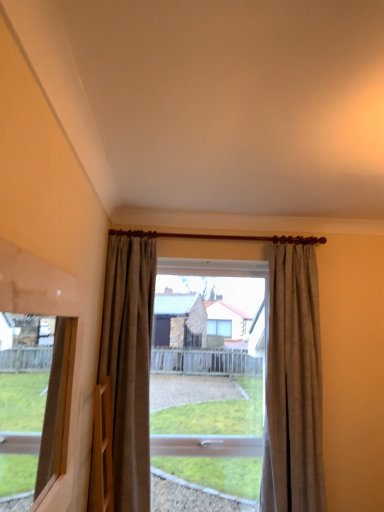
This screenshot has height=512, width=384. I want to click on matte brown curtain at center, positioned as the second curtain in right-to-left order, so click(x=129, y=362).

From the image's perspective, is beige textured curtain at center, acting as the 1th curtain starting from the right, located above or below wooden frame at left?

beige textured curtain at center, acting as the 1th curtain starting from the right, is below wooden frame at left.

Who is bigger, beige textured curtain at center, which appears as the second curtain when viewed from the left, or wooden frame at left?

Bigger between the two is beige textured curtain at center, which appears as the second curtain when viewed from the left.

Can you confirm if beige textured curtain at center, which appears as the second curtain when viewed from the left, is shorter than wooden frame at left?

Incorrect, the height of beige textured curtain at center, which appears as the second curtain when viewed from the left, does not fall short of that of wooden frame at left.

Does beige textured curtain at center, acting as the 1th curtain starting from the right, have a greater width compared to wooden frame at left?

Yes, beige textured curtain at center, acting as the 1th curtain starting from the right, is wider than wooden frame at left.

From a real-world perspective, between transparent glass window at center and beige textured curtain at center, acting as the 1th curtain starting from the right, who is vertically lower?

transparent glass window at center is physically lower.

Between point (160, 372) and point (308, 313), which one is positioned in front?

The point (308, 313) is more forward.

Is transparent glass window at center touching beige textured curtain at center, which appears as the second curtain when viewed from the left?

transparent glass window at center and beige textured curtain at center, which appears as the second curtain when viewed from the left, are clearly separated.

From the picture: Is matte brown curtain at center, arranged as the 1th curtain when viewed from the left, to the left or to the right of wooden frame at left in the image?

In the image, matte brown curtain at center, arranged as the 1th curtain when viewed from the left, appears on the right side of wooden frame at left.

From the image's perspective, between matte brown curtain at center, arranged as the 1th curtain when viewed from the left, and wooden frame at left, who is located below?

matte brown curtain at center, arranged as the 1th curtain when viewed from the left.

The image size is (384, 512). I want to click on window above the matte brown curtain at center, positioned as the second curtain in right-to-left order (from a real-world perspective), so click(32, 407).

Is transparent glass window at center not inside wooden frame at left?

transparent glass window at center is positioned outside wooden frame at left.

Locate an element on the screen. window above the transparent glass window at center (from the image's perspective) is located at coordinates (32, 407).

Who is bigger, transparent glass window at center or wooden frame at left?

transparent glass window at center is bigger.

Is point (165, 310) closer to camera compared to point (5, 480)?

That is False.

Can you tell me how much beige textured curtain at center, acting as the 1th curtain starting from the right, and transparent glass window at center differ in facing direction?

There is a 2.83-degree angle between the facing directions of beige textured curtain at center, acting as the 1th curtain starting from the right, and transparent glass window at center.

Considering the positions of objects beige textured curtain at center, which appears as the second curtain when viewed from the left, and transparent glass window at center in the image provided, who is more to the right, beige textured curtain at center, which appears as the second curtain when viewed from the left, or transparent glass window at center?

From the viewer's perspective, beige textured curtain at center, which appears as the second curtain when viewed from the left, appears more on the right side.

Is beige textured curtain at center, acting as the 1th curtain starting from the right, positioned behind transparent glass window at center?

No, beige textured curtain at center, acting as the 1th curtain starting from the right, is closer to the viewer.

From the image's perspective, between beige textured curtain at center, which appears as the second curtain when viewed from the left, and transparent glass window at center, who is located below?

From the image's view, transparent glass window at center is below.

From the image's perspective, is wooden frame at left positioned above or below transparent glass window at center?

Based on their image positions, wooden frame at left is located above transparent glass window at center.

Image resolution: width=384 pixels, height=512 pixels. I want to click on window in front of the transparent glass window at center, so click(32, 407).

Considering the positions of points (5, 350) and (177, 450), is point (5, 350) closer to camera compared to point (177, 450)?

Yes, it is in front of point (177, 450).

Is wooden frame at left wider or thinner than transparent glass window at center?

Clearly, wooden frame at left has less width compared to transparent glass window at center.

Is wooden frame at left at the left side of beige textured curtain at center, acting as the 1th curtain starting from the right?

Indeed, wooden frame at left is positioned on the left side of beige textured curtain at center, acting as the 1th curtain starting from the right.

Is wooden frame at left bigger or smaller than beige textured curtain at center, acting as the 1th curtain starting from the right?

Considering their sizes, wooden frame at left takes up less space than beige textured curtain at center, acting as the 1th curtain starting from the right.

Which is correct: wooden frame at left is inside beige textured curtain at center, acting as the 1th curtain starting from the right, or outside of it?

wooden frame at left is not enclosed by beige textured curtain at center, acting as the 1th curtain starting from the right.

Looking at this image, is wooden frame at left touching beige textured curtain at center, acting as the 1th curtain starting from the right?

No, wooden frame at left is not beside beige textured curtain at center, acting as the 1th curtain starting from the right.

Locate an element on the screen. This screenshot has height=512, width=384. the 1st curtain behind the wooden frame at left, starting your count from the anchor is located at coordinates (293, 386).

Where is `curtain that is on the right side of transparent glass window at center`? This screenshot has width=384, height=512. curtain that is on the right side of transparent glass window at center is located at coordinates (293, 386).

Considering their positions, is wooden frame at left positioned closer to transparent glass window at center than matte brown curtain at center, positioned as the second curtain in right-to-left order?

matte brown curtain at center, positioned as the second curtain in right-to-left order.

Considering their positions, is transparent glass window at center positioned further to wooden frame at left than matte brown curtain at center, arranged as the 1th curtain when viewed from the left?

transparent glass window at center is positioned further to the anchor wooden frame at left.

From the image, which object appears to be nearer to matte brown curtain at center, positioned as the second curtain in right-to-left order, beige textured curtain at center, which appears as the second curtain when viewed from the left, or transparent glass window at center?

The object closer to matte brown curtain at center, positioned as the second curtain in right-to-left order, is beige textured curtain at center, which appears as the second curtain when viewed from the left.

Estimate the real-world distances between objects in this image. Which object is further from matte brown curtain at center, arranged as the 1th curtain when viewed from the left, transparent glass window at center or beige textured curtain at center, which appears as the second curtain when viewed from the left?

transparent glass window at center.

Which object lies further to the anchor point transparent glass window at center, beige textured curtain at center, acting as the 1th curtain starting from the right, or wooden frame at left?

wooden frame at left is positioned further to the anchor transparent glass window at center.

Looking at this image, considering their positions, is matte brown curtain at center, positioned as the second curtain in right-to-left order, positioned further to beige textured curtain at center, acting as the 1th curtain starting from the right, than wooden frame at left?

wooden frame at left is positioned further to the anchor beige textured curtain at center, acting as the 1th curtain starting from the right.

Looking at the image, which one is located closer to matte brown curtain at center, arranged as the 1th curtain when viewed from the left, beige textured curtain at center, which appears as the second curtain when viewed from the left, or wooden frame at left?

The object closer to matte brown curtain at center, arranged as the 1th curtain when viewed from the left, is wooden frame at left.

Based on their spatial positions, is beige textured curtain at center, which appears as the second curtain when viewed from the left, or transparent glass window at center further from wooden frame at left?

beige textured curtain at center, which appears as the second curtain when viewed from the left.

What are the coordinates of `bay window between matte brown curtain at center, positioned as the second curtain in right-to-left order, and beige textured curtain at center, acting as the 1th curtain starting from the right, from left to right` in the screenshot? It's located at (209, 384).

Where is `curtain between wooden frame at left and matte brown curtain at center, positioned as the second curtain in right-to-left order, along the z-axis`? The width and height of the screenshot is (384, 512). curtain between wooden frame at left and matte brown curtain at center, positioned as the second curtain in right-to-left order, along the z-axis is located at coordinates (293, 386).